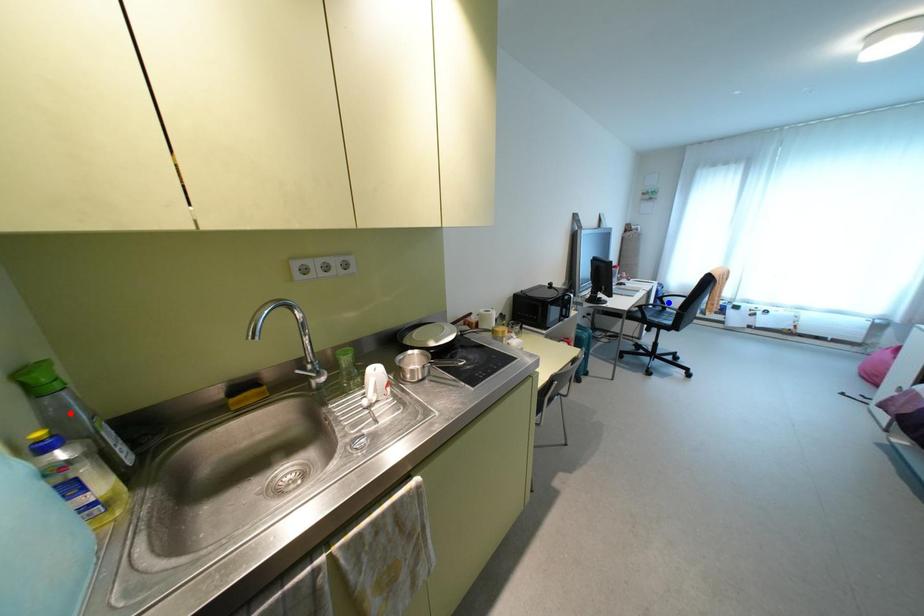
Question: In the image, two points are highlighted. Which point is nearer to the camera? Reply with the corresponding letter.

Choices:
 (A) blue point
 (B) red point

Answer: (B)